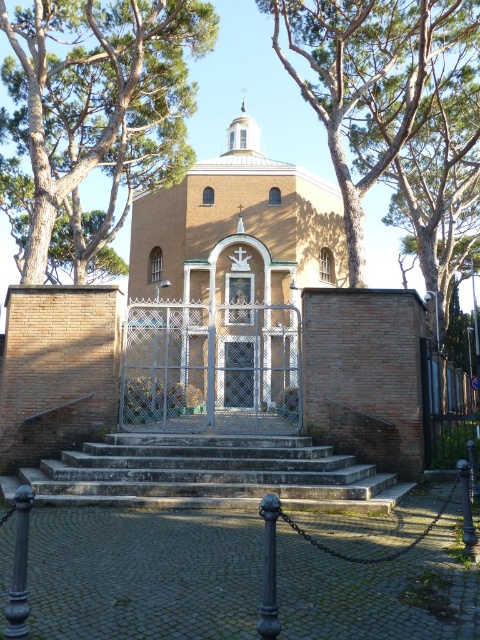
Can you confirm if brown textured tree at upper center is taller than stone steps at center?

Yes, brown textured tree at upper center is taller than stone steps at center.

The height and width of the screenshot is (640, 480). What do you see at coordinates (369, 80) in the screenshot?
I see `brown textured tree at upper center` at bounding box center [369, 80].

Who is more forward, (x=382, y=16) or (x=108, y=461)?

Positioned in front is point (x=108, y=461).

Identify the location of brown textured tree at upper center. (369, 80).

Is the position of brown brick church at center more distant than that of green leafy tree at upper center?

No, it is in front of green leafy tree at upper center.

Based on the photo, can you confirm if brown brick church at center is positioned above green leafy tree at upper center?

No, brown brick church at center is not above green leafy tree at upper center.

Which is in front, point (117, 381) or point (47, 241)?

Point (117, 381)

The width and height of the screenshot is (480, 640). I want to click on brown brick church at center, so click(216, 369).

Does green leafy tree at upper center appear on the right side of beige brick church at center?

In fact, green leafy tree at upper center is to the left of beige brick church at center.

Who is taller, green leafy tree at upper center or beige brick church at center?

green leafy tree at upper center is taller.

This screenshot has width=480, height=640. Identify the location of green leafy tree at upper center. (98, 97).